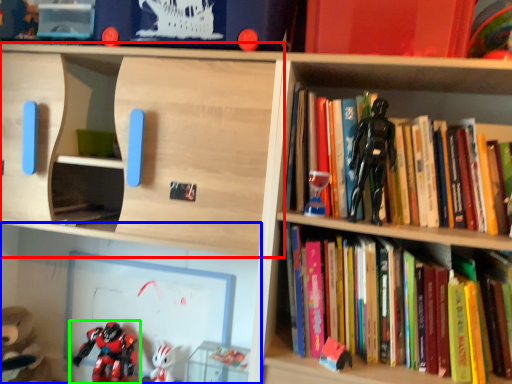
Question: Which object is positioned closest to shelf (highlighted by a red box)? Select from shelf (highlighted by a blue box) and toy (highlighted by a green box).

Choices:
 (A) shelf
 (B) toy

Answer: (A)